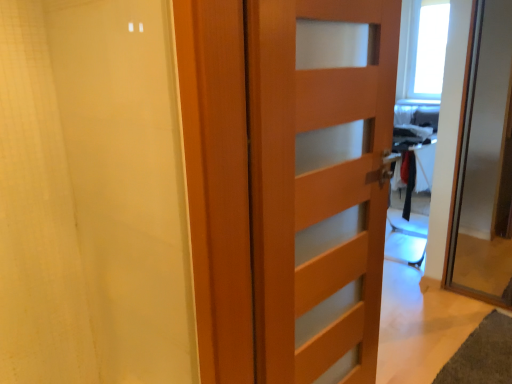
Question: Is wooden door at center, which is the second door in right-to-left order, taller than wooden door at right, which appears as the first door when viewed from the right?

Choices:
 (A) yes
 (B) no

Answer: (A)

Question: Can we say wooden door at center, which is the second door in right-to-left order, lies outside wooden door at right, which appears as the first door when viewed from the right?

Choices:
 (A) no
 (B) yes

Answer: (B)

Question: Considering the relative sizes of wooden door at center, the 1th door positioned from the left, and wooden door at right, arranged as the 2th door when viewed from the left, in the image provided, is wooden door at center, the 1th door positioned from the left, smaller than wooden door at right, arranged as the 2th door when viewed from the left,?

Choices:
 (A) no
 (B) yes

Answer: (B)

Question: From the image's perspective, is wooden door at center, the 1th door positioned from the left, located beneath wooden door at right, which appears as the first door when viewed from the right?

Choices:
 (A) no
 (B) yes

Answer: (B)

Question: Is wooden door at center, the 1th door positioned from the left, further to the viewer compared to wooden door at right, which appears as the first door when viewed from the right?

Choices:
 (A) no
 (B) yes

Answer: (A)

Question: Does wooden door at center, which is the second door in right-to-left order, have a larger size compared to wooden door at right, which appears as the first door when viewed from the right?

Choices:
 (A) no
 (B) yes

Answer: (A)

Question: Considering the relative positions of wooden door at right, which appears as the first door when viewed from the right, and white matte shower curtain at left in the image provided, is wooden door at right, which appears as the first door when viewed from the right, in front of white matte shower curtain at left?

Choices:
 (A) no
 (B) yes

Answer: (A)

Question: Does wooden door at right, arranged as the 2th door when viewed from the left, lie behind white matte shower curtain at left?

Choices:
 (A) no
 (B) yes

Answer: (B)

Question: Does wooden door at right, arranged as the 2th door when viewed from the left, appear on the left side of white matte shower curtain at left?

Choices:
 (A) no
 (B) yes

Answer: (A)

Question: Is wooden door at right, which appears as the first door when viewed from the right, at the right side of white matte shower curtain at left?

Choices:
 (A) yes
 (B) no

Answer: (A)

Question: Is wooden door at right, which appears as the first door when viewed from the right, not near white matte shower curtain at left?

Choices:
 (A) yes
 (B) no

Answer: (A)

Question: Is wooden door at right, arranged as the 2th door when viewed from the left, directly adjacent to white matte shower curtain at left?

Choices:
 (A) yes
 (B) no

Answer: (B)

Question: From the image's perspective, would you say wooden door at center, the 1th door positioned from the left, is shown under white matte shower curtain at left?

Choices:
 (A) no
 (B) yes

Answer: (B)